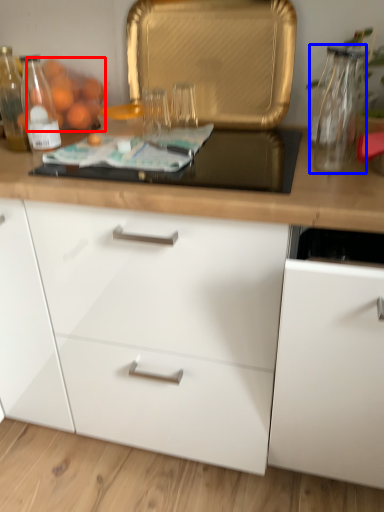
Question: Among these objects, which one is nearest to the camera, fruit (highlighted by a red box) or glass vase (highlighted by a blue box)?

Choices:
 (A) fruit
 (B) glass vase

Answer: (B)